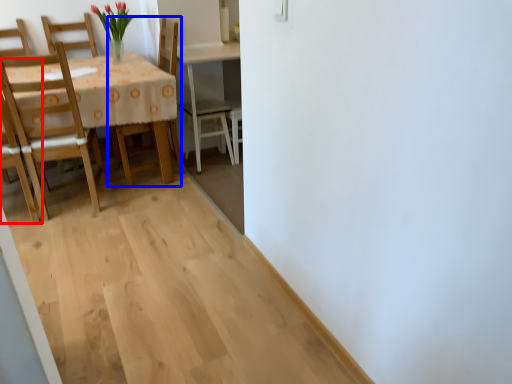
Question: Among these objects, which one is nearest to the camera, chair (highlighted by a red box) or chair (highlighted by a blue box)?

Choices:
 (A) chair
 (B) chair

Answer: (A)